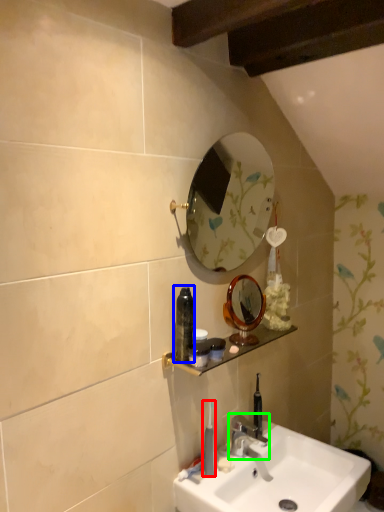
Question: Based on their relative distances, which object is nearer to toothbrush (highlighted by a red box)? Choose from mouthwash (highlighted by a blue box) and tap (highlighted by a green box).

Choices:
 (A) mouthwash
 (B) tap

Answer: (B)